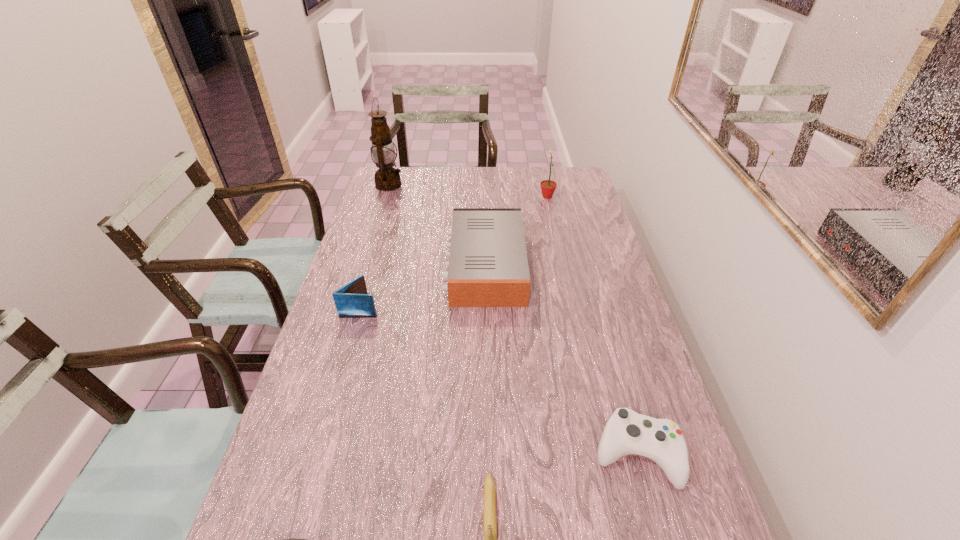
Where is `oil lamp`? The image size is (960, 540). oil lamp is located at coordinates point(387,178).

Find the location of a particular element. the second tallest object is located at coordinates (548, 187).

Locate an element on the screen. radio receiver is located at coordinates (488, 267).

This screenshot has height=540, width=960. What are the coordinates of `wallet` in the screenshot? It's located at (352, 300).

This screenshot has width=960, height=540. What are the coordinates of `the right control` in the screenshot? It's located at pyautogui.click(x=626, y=433).

Image resolution: width=960 pixels, height=540 pixels. What are the coordinates of `free spot located 0.380m on the front of the oil lamp` in the screenshot? It's located at [369, 252].

At what (x,y) coordinates should I click in order to perform the action: click on vacant space located on the face of the second tallest object. Please return your answer as a coordinate pair (x, y). The height and width of the screenshot is (540, 960). Looking at the image, I should click on (488, 197).

You are a GUI agent. You are given a task and a screenshot of the screen. Output one action in this format:
    pyautogui.click(x=<x>, y=<y>)
    Task: Click on the blank space located 0.360m on the face of the second tallest object
    This screenshot has height=540, width=960.
    Given the screenshot: What is the action you would take?
    pyautogui.click(x=451, y=197)

What are the coordinates of `vacant area situated on the face of the second tallest object` in the screenshot? It's located at (473, 197).

Where is `vacant space located on the control panel of the radio receiver`? vacant space located on the control panel of the radio receiver is located at coordinates (416, 265).